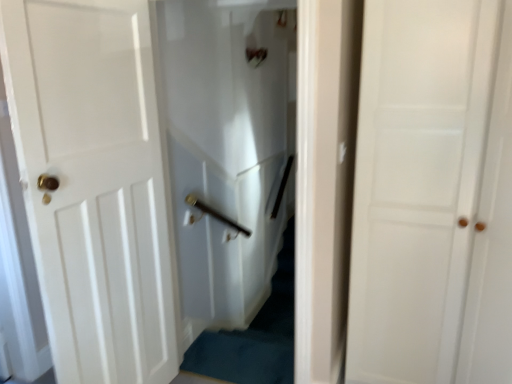
Locate an element on the screen. white matte door at center, the 1th door in the right-to-left sequence is located at coordinates (433, 195).

Are white glossy elevator at center and white matte door at center, the 1th door in the right-to-left sequence, making contact?

white glossy elevator at center and white matte door at center, the 1th door in the right-to-left sequence, are clearly separated.

Considering the relative positions of white glossy elevator at center and white matte door at center, the 1th door in the right-to-left sequence, in the image provided, is white glossy elevator at center to the right of white matte door at center, the 1th door in the right-to-left sequence, from the viewer's perspective?

No.

Between white glossy elevator at center and white matte door at center, which appears as the second door when viewed from the left, which one has more height?

white matte door at center, which appears as the second door when viewed from the left.

The image size is (512, 384). In order to click on door in front of the white glossy door at left, the 2th door positioned from the right in this screenshot , I will do `click(433, 195)`.

Looking at this image, considering the relative sizes of white matte door at center, which appears as the second door when viewed from the left, and white glossy door at left, which appears as the 1th door when viewed from the left, in the image provided, is white matte door at center, which appears as the second door when viewed from the left, thinner than white glossy door at left, which appears as the 1th door when viewed from the left,?

Incorrect, the width of white matte door at center, which appears as the second door when viewed from the left, is not less than that of white glossy door at left, which appears as the 1th door when viewed from the left.

Is white matte door at center, the 1th door in the right-to-left sequence, inside the boundaries of white glossy door at left, which appears as the 1th door when viewed from the left, or outside?

white matte door at center, the 1th door in the right-to-left sequence, is not inside white glossy door at left, which appears as the 1th door when viewed from the left, it's outside.

Can you see white matte door at center, which appears as the second door when viewed from the left, touching white glossy door at left, the 2th door positioned from the right?

No, white matte door at center, which appears as the second door when viewed from the left, is not making contact with white glossy door at left, the 2th door positioned from the right.

From a real-world perspective, is white glossy door at left, which appears as the 1th door when viewed from the left, physically located above or below white glossy elevator at center?

From a real-world perspective, white glossy door at left, which appears as the 1th door when viewed from the left, is physically below white glossy elevator at center.

Is white glossy door at left, which appears as the 1th door when viewed from the left, bigger or smaller than white glossy elevator at center?

Considering their sizes, white glossy door at left, which appears as the 1th door when viewed from the left, takes up more space than white glossy elevator at center.

Which object is thinner, white glossy door at left, the 2th door positioned from the right, or white glossy elevator at center?

white glossy elevator at center is thinner.

How many degrees apart are the facing directions of white glossy door at left, the 2th door positioned from the right, and white glossy elevator at center?

82.4 degrees.

At what (x,y) coordinates should I click in order to perform the action: click on elevator above the white matte door at center, which appears as the second door when viewed from the left (from the image's perspective). Please return your answer as a coordinate pair (x, y). Looking at the image, I should click on (227, 149).

From the image's perspective, which object appears higher, white matte door at center, the 1th door in the right-to-left sequence, or white glossy elevator at center?

white glossy elevator at center is shown above in the image.

Is white matte door at center, which appears as the second door when viewed from the left, in front of or behind white glossy elevator at center in the image?

Clearly, white matte door at center, which appears as the second door when viewed from the left, is in front of white glossy elevator at center.

Which is behind, white glossy door at left, the 2th door positioned from the right, or white matte door at center, which appears as the second door when viewed from the left?

white glossy door at left, the 2th door positioned from the right.

Is white glossy door at left, which appears as the 1th door when viewed from the left, at the left side of white matte door at center, which appears as the second door when viewed from the left?

Yes.

Which point is more forward, (106, 362) or (465, 54)?

The point (465, 54) is closer to the camera.

Does white glossy elevator at center have a greater height compared to white glossy door at left, the 2th door positioned from the right?

In fact, white glossy elevator at center may be shorter than white glossy door at left, the 2th door positioned from the right.

Would you say white glossy elevator at center is a long distance from white glossy door at left, the 2th door positioned from the right?

No.

Which of these two, white glossy elevator at center or white glossy door at left, which appears as the 1th door when viewed from the left, is thinner?

white glossy elevator at center is thinner.

From a real-world perspective, is white glossy elevator at center located higher than white glossy door at left, which appears as the 1th door when viewed from the left?

Yes, from a real-world perspective, white glossy elevator at center is on top of white glossy door at left, which appears as the 1th door when viewed from the left.

Find the location of a particular element. Image resolution: width=512 pixels, height=384 pixels. door above the white glossy elevator at center (from a real-world perspective) is located at coordinates (433, 195).

Where is `door in front of the white glossy door at left, the 2th door positioned from the right`? This screenshot has width=512, height=384. door in front of the white glossy door at left, the 2th door positioned from the right is located at coordinates (433, 195).

When comparing their distances from white glossy elevator at center, does white glossy door at left, which appears as the 1th door when viewed from the left, or white matte door at center, which appears as the second door when viewed from the left, seem further?

white matte door at center, which appears as the second door when viewed from the left, is further to white glossy elevator at center.

Estimate the real-world distances between objects in this image. Which object is further from white glossy elevator at center, white matte door at center, which appears as the second door when viewed from the left, or white glossy door at left, which appears as the 1th door when viewed from the left?

white matte door at center, which appears as the second door when viewed from the left.

Which object lies nearer to the anchor point white matte door at center, which appears as the second door when viewed from the left, white glossy door at left, the 2th door positioned from the right, or white glossy elevator at center?

white glossy door at left, the 2th door positioned from the right, is positioned closer to the anchor white matte door at center, which appears as the second door when viewed from the left.

Looking at the image, which one is located further to white glossy door at left, which appears as the 1th door when viewed from the left, white matte door at center, the 1th door in the right-to-left sequence, or white glossy elevator at center?

white matte door at center, the 1th door in the right-to-left sequence, is further to white glossy door at left, which appears as the 1th door when viewed from the left.

Considering their positions, is white glossy elevator at center positioned closer to white matte door at center, which appears as the second door when viewed from the left, than white glossy door at left, which appears as the 1th door when viewed from the left?

white glossy door at left, which appears as the 1th door when viewed from the left, is closer to white matte door at center, which appears as the second door when viewed from the left.

When comparing their distances from white glossy door at left, the 2th door positioned from the right, does white glossy elevator at center or white matte door at center, which appears as the second door when viewed from the left, seem further?

Based on the image, white matte door at center, which appears as the second door when viewed from the left, appears to be further to white glossy door at left, the 2th door positioned from the right.

Find the location of a particular element. This screenshot has width=512, height=384. elevator between white glossy door at left, which appears as the 1th door when viewed from the left, and white matte door at center, the 1th door in the right-to-left sequence, in the horizontal direction is located at coordinates (227, 149).